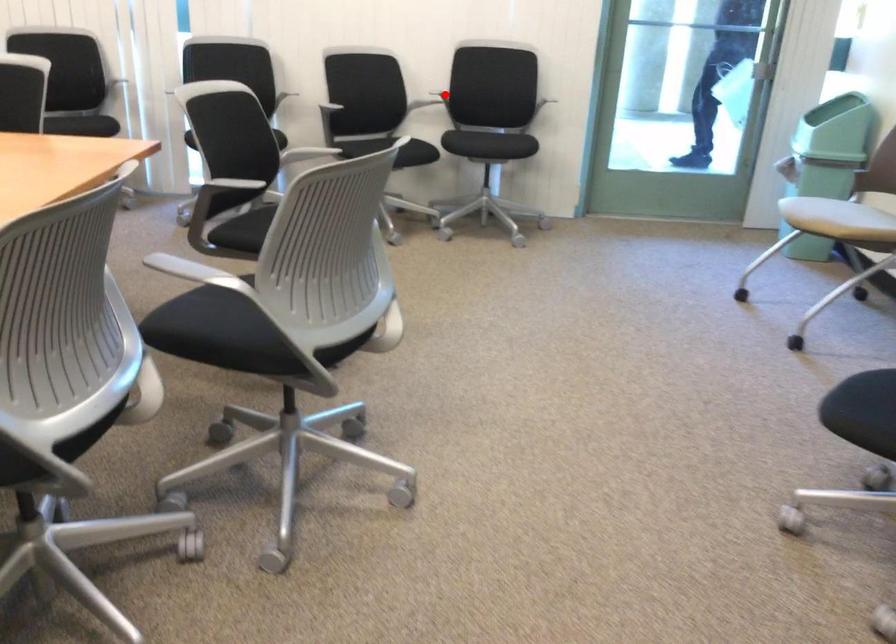
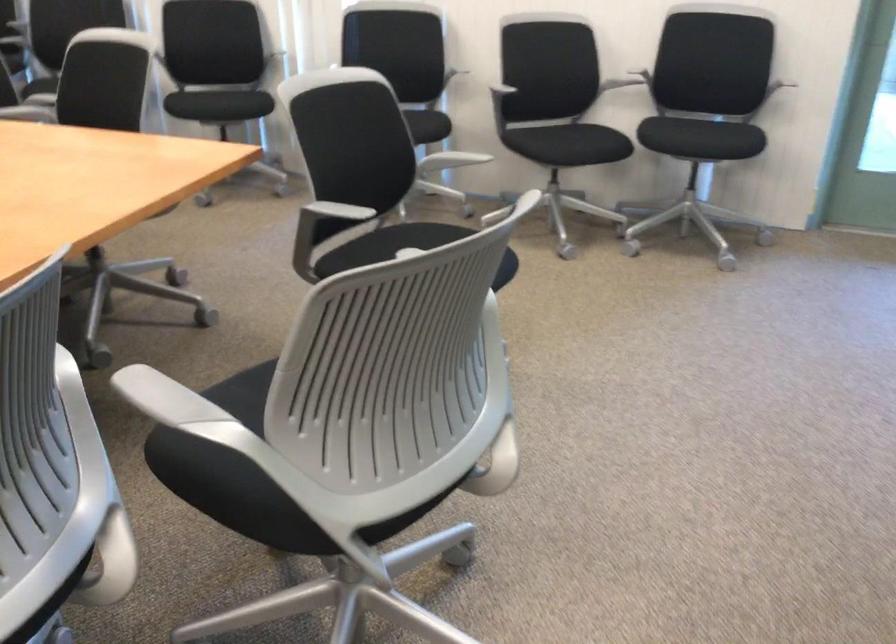
Find the pixel in the second image that matches the highlighted location in the first image.

(638, 79)